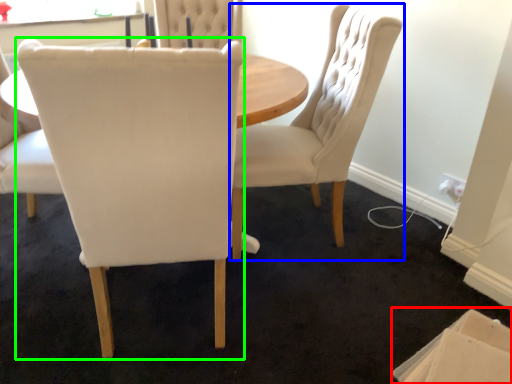
Question: Estimate the real-world distances between objects in this image. Which object is farther from cardboard box (highlighted by a red box), chair (highlighted by a blue box) or chair (highlighted by a green box)?

Choices:
 (A) chair
 (B) chair

Answer: (B)